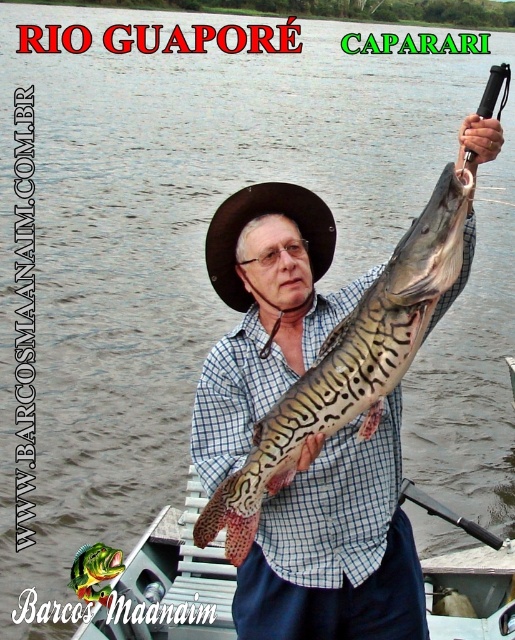
Is speckled skin fish at center closer to the viewer compared to brown felt cowboy hat at upper center?

Yes, speckled skin fish at center is in front of brown felt cowboy hat at upper center.

Is point (348, 403) farther from camera compared to point (206, 259)?

No.

Between point (339, 426) and point (307, 214), which one is positioned behind?

The point (307, 214) is more distant.

Identify the location of speckled skin fish at center. This screenshot has height=640, width=515. (348, 365).